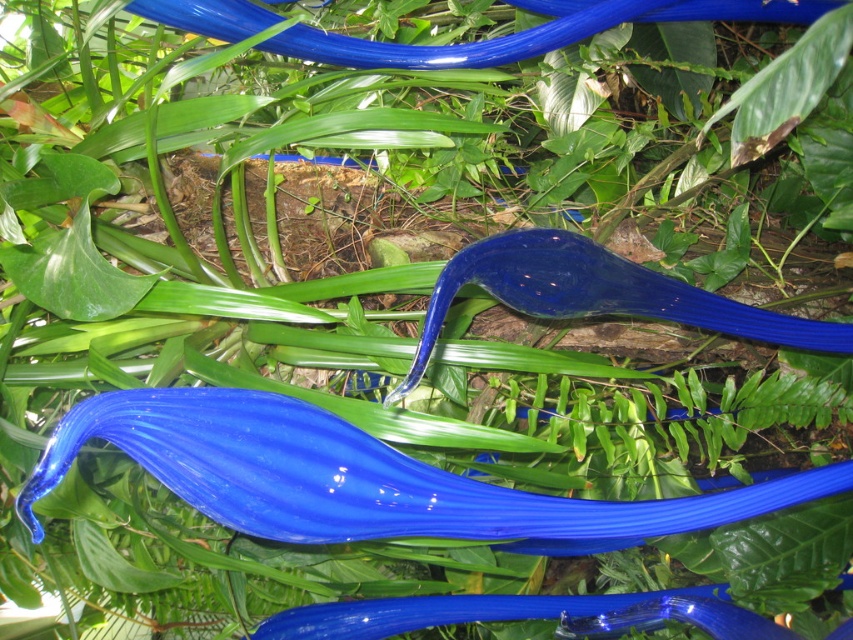
This screenshot has width=853, height=640. Describe the element at coordinates (363, 477) in the screenshot. I see `glossy blue hose at center` at that location.

Can you confirm if glossy blue hose at center is positioned above glossy blue hose at upper center?

Incorrect, glossy blue hose at center is not positioned above glossy blue hose at upper center.

The image size is (853, 640). What are the coordinates of `glossy blue hose at center` in the screenshot? It's located at (363, 477).

In order to click on glossy blue hose at center in this screenshot , I will do `click(363, 477)`.

Between glossy blue hose at center and glossy glass hose at center, which one is positioned higher?

glossy glass hose at center

Between glossy blue hose at center and glossy glass hose at center, which one has less height?

glossy glass hose at center

Does point (364, 442) come farther from viewer compared to point (485, 262)?

No, it is in front of (485, 262).

Where is `glossy blue hose at center`? glossy blue hose at center is located at coordinates (363, 477).

Locate an element on the screen. The image size is (853, 640). glossy glass hose at center is located at coordinates (598, 292).

The height and width of the screenshot is (640, 853). Find the location of `glossy glass hose at center`. glossy glass hose at center is located at coordinates (598, 292).